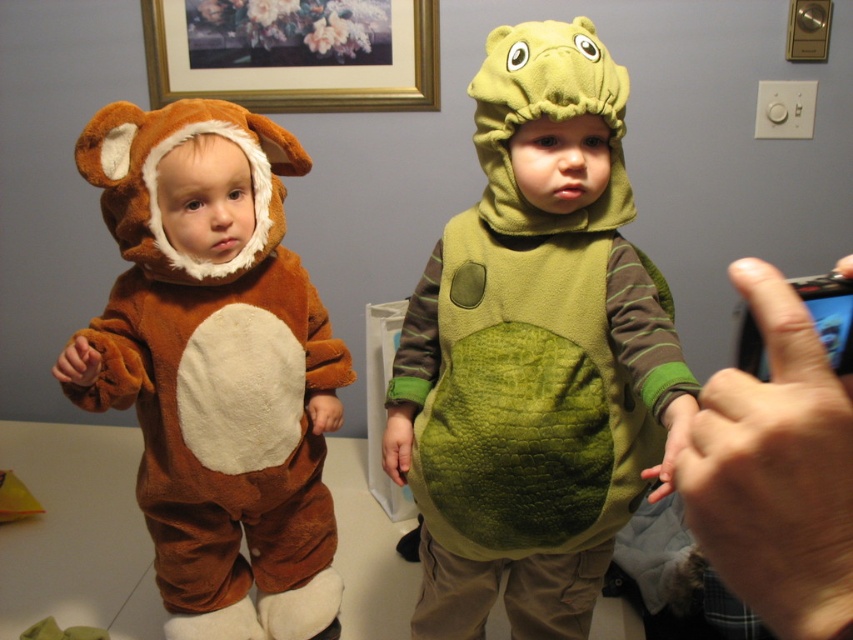
You are taking a photo of the velvety green dinosaur costume at center and the smooth black phone at right. Which object should you focus on first if you want to capture both clearly in the same frame?

The velvety green dinosaur costume at center is larger than the smooth black phone at right, so you should focus on the larger object first to ensure both are in focus.

You are organizing a costume party and need to determine which costume requires more storage space. Based on the image, which costume between the velvety green dinosaur costume at center and the brown plush bear at left takes up more space?

The velvety green dinosaur costume at center has a larger size compared to the brown plush bear at left, so it requires more storage space.

You are holding a smooth black phone at right and want to take a photo of the velvety green dinosaur costume at center. The phone has a maximum focus distance of 60 centimeters. Will you be able to capture a clear photo of the costume?

The velvety green dinosaur costume at center is 64.90 centimeters away from the smooth black phone at right. Since the phone can only focus up to 60 centimeters, you won cannot capture a clear photo of the costume.